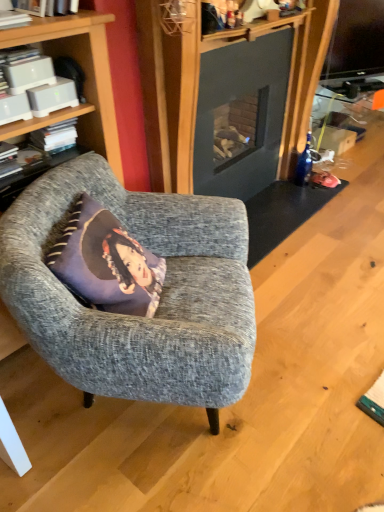
I want to click on textured gray armchair at left, so click(160, 298).

Find the location of a particular element. white plastic book at upper left, the second book positioned from the back is located at coordinates (26, 69).

Describe the element at coordinates (13, 19) in the screenshot. The image size is (384, 512). I see `white matte book at upper left, which is the 3th book from back to front` at that location.

Locate an element on the screen. This screenshot has height=512, width=384. white matte book at left, positioned as the first book in back-to-front order is located at coordinates (55, 137).

Where is `purple fabric pillow at center`? The height and width of the screenshot is (512, 384). purple fabric pillow at center is located at coordinates (106, 263).

Is textured gray armchair at left bigger than white plastic book at upper left, which appears as the 2th book when viewed from the front?

Correct, textured gray armchair at left is larger in size than white plastic book at upper left, which appears as the 2th book when viewed from the front.

Considering the positions of point (44, 264) and point (32, 82), is point (44, 264) closer or farther from the camera than point (32, 82)?

Point (44, 264) appears to be closer to the viewer than point (32, 82).

From the textured gray armchair at left, count the 2nd book to the left and point to it. Please provide its 2D coordinates.

[(26, 69)]

How different are the orientations of textured gray armchair at left and white plastic book at upper left, the second book positioned from the back, in degrees?

32.1 degrees.

Considering the sizes of objects white plastic book at upper left, the second book positioned from the back, and white matte book at left, positioned as the first book in back-to-front order, in the image provided, who is wider, white plastic book at upper left, the second book positioned from the back, or white matte book at left, positioned as the first book in back-to-front order,?

white plastic book at upper left, the second book positioned from the back, is wider.

Where is `book below the white plastic book at upper left, which appears as the 2th book when viewed from the front (from a real-world perspective)`? book below the white plastic book at upper left, which appears as the 2th book when viewed from the front (from a real-world perspective) is located at coordinates (55, 137).

Is white plastic book at upper left, the second book positioned from the back, positioned before white matte book at left, positioned as the first book in back-to-front order?

Yes, the depth of white plastic book at upper left, the second book positioned from the back, is less than that of white matte book at left, positioned as the first book in back-to-front order.

Which of these two, white plastic book at upper left, the second book positioned from the back, or white matte book at left, the third book when ordered from front to back, is smaller?

Smaller between the two is white matte book at left, the third book when ordered from front to back.

What's the angular difference between white matte book at upper left, which is the 3th book from back to front, and white matte book at left, the third book when ordered from front to back,'s facing directions?

There is a 0.000981-degree angle between the facing directions of white matte book at upper left, which is the 3th book from back to front, and white matte book at left, the third book when ordered from front to back.

Does white matte book at upper left, which is the 3th book from back to front, come behind white matte book at left, the third book when ordered from front to back?

No, the depth of white matte book at upper left, which is the 3th book from back to front, is less than that of white matte book at left, the third book when ordered from front to back.

From the image's perspective, which object appears higher, white matte book at upper left, which is the 3th book from back to front, or white matte book at left, positioned as the first book in back-to-front order?

white matte book at upper left, which is the 3th book from back to front, appears higher in the image.

Is purple fabric pillow at center not within white plastic book at upper left, which appears as the 2th book when viewed from the front?

Yes.

Which object is closer to the camera taking this photo, purple fabric pillow at center or white plastic book at upper left, the second book positioned from the back?

purple fabric pillow at center is closer to the camera.

The width and height of the screenshot is (384, 512). In order to click on pillow located underneath the white plastic book at upper left, the second book positioned from the back (from a real-world perspective) in this screenshot , I will do `click(106, 263)`.

In terms of size, does purple fabric pillow at center appear bigger or smaller than white plastic book at upper left, the second book positioned from the back?

In the image, purple fabric pillow at center appears to be larger than white plastic book at upper left, the second book positioned from the back.

From the image's perspective, is white plastic book at upper left, which appears as the 2th book when viewed from the front, below textured gray armchair at left?

No, from the image's perspective, white plastic book at upper left, which appears as the 2th book when viewed from the front, is not beneath textured gray armchair at left.

Based on the photo, between white plastic book at upper left, the second book positioned from the back, and textured gray armchair at left, which one has smaller width?

With smaller width is white plastic book at upper left, the second book positioned from the back.

Can you confirm if white plastic book at upper left, which appears as the 2th book when viewed from the front, is positioned to the right of textured gray armchair at left?

Incorrect, white plastic book at upper left, which appears as the 2th book when viewed from the front, is not on the right side of textured gray armchair at left.

Starting from the textured gray armchair at left, which book is the 2nd one behind? Please provide its 2D coordinates.

[(26, 69)]

Is dark gray fabric cushion at left inside purple fabric pillow at center?

That's incorrect, dark gray fabric cushion at left is not inside purple fabric pillow at center.

Which of these two, purple fabric pillow at center or dark gray fabric cushion at left, is wider?

With larger width is purple fabric pillow at center.

Are purple fabric pillow at center and dark gray fabric cushion at left located far from each other?

That's not correct — purple fabric pillow at center is a little close to dark gray fabric cushion at left.

From a real-world perspective, relative to white plastic book at upper left, the second book positioned from the back, is dark gray fabric cushion at left vertically above or below?

Clearly, from a real-world perspective, dark gray fabric cushion at left is below white plastic book at upper left, the second book positioned from the back.

Is dark gray fabric cushion at left aimed at white plastic book at upper left, which appears as the 2th book when viewed from the front?

No.

Who is smaller, dark gray fabric cushion at left or white plastic book at upper left, which appears as the 2th book when viewed from the front?

Smaller between the two is white plastic book at upper left, which appears as the 2th book when viewed from the front.

Identify the location of chair below the white plastic book at upper left, which appears as the 2th book when viewed from the front (from a real-world perspective). (160, 298).

Identify the location of book below the white plastic book at upper left, which appears as the 2th book when viewed from the front (from the image's perspective). This screenshot has width=384, height=512. (55, 137).

Based on their spatial positions, is white matte book at left, positioned as the first book in back-to-front order, or white plastic book at upper left, the second book positioned from the back, closer to purple fabric pillow at center?

white matte book at left, positioned as the first book in back-to-front order, lies closer to purple fabric pillow at center than the other object.

Based on their spatial positions, is purple fabric pillow at center or white matte book at left, the third book when ordered from front to back, closer to textured gray armchair at left?

Among the two, purple fabric pillow at center is located nearer to textured gray armchair at left.

Consider the image. From the image, which object appears to be farther from white matte book at upper left, which is the 3th book from back to front, white plastic book at upper left, which appears as the 2th book when viewed from the front, or dark gray fabric cushion at left?

Among the two, dark gray fabric cushion at left is located further to white matte book at upper left, which is the 3th book from back to front.

In the scene shown: Which object lies nearer to the anchor point white matte book at upper left, which is the 3th book from back to front, white matte book at left, the third book when ordered from front to back, or dark gray fabric cushion at left?

The object closer to white matte book at upper left, which is the 3th book from back to front, is dark gray fabric cushion at left.

Estimate the real-world distances between objects in this image. Which object is closer to purple fabric pillow at center, white matte book at left, the third book when ordered from front to back, or white matte book at upper left, which is the first book from front to back?

Among the two, white matte book at left, the third book when ordered from front to back, is located nearer to purple fabric pillow at center.

Based on their spatial positions, is white plastic book at upper left, which appears as the 2th book when viewed from the front, or textured gray armchair at left closer to purple fabric pillow at center?

Among the two, textured gray armchair at left is located nearer to purple fabric pillow at center.

Which object lies nearer to the anchor point dark gray fabric cushion at left, white matte book at left, the third book when ordered from front to back, or textured gray armchair at left?

white matte book at left, the third book when ordered from front to back, lies closer to dark gray fabric cushion at left than the other object.

Consider the image. Estimate the real-world distances between objects in this image. Which object is further from dark gray fabric cushion at left, white plastic book at upper left, which appears as the 2th book when viewed from the front, or purple fabric pillow at center?

Among the two, purple fabric pillow at center is located further to dark gray fabric cushion at left.

The height and width of the screenshot is (512, 384). I want to click on book between white plastic book at upper left, which appears as the 2th book when viewed from the front, and textured gray armchair at left, in the vertical direction, so click(55, 137).

I want to click on pillow that lies between white plastic book at upper left, which appears as the 2th book when viewed from the front, and textured gray armchair at left from top to bottom, so click(x=106, y=263).

Image resolution: width=384 pixels, height=512 pixels. Identify the location of pillow between white matte book at left, the third book when ordered from front to back, and textured gray armchair at left in the up-down direction. (106, 263).

You are a GUI agent. You are given a task and a screenshot of the screen. Output one action in this format:
    pyautogui.click(x=<x>, y=<y>)
    Task: Click on the shelf that lies between white matte book at upper left, which is the first book from front to back, and textured gray armchair at left from top to bottom
    
    Given the screenshot: What is the action you would take?
    pyautogui.click(x=42, y=121)